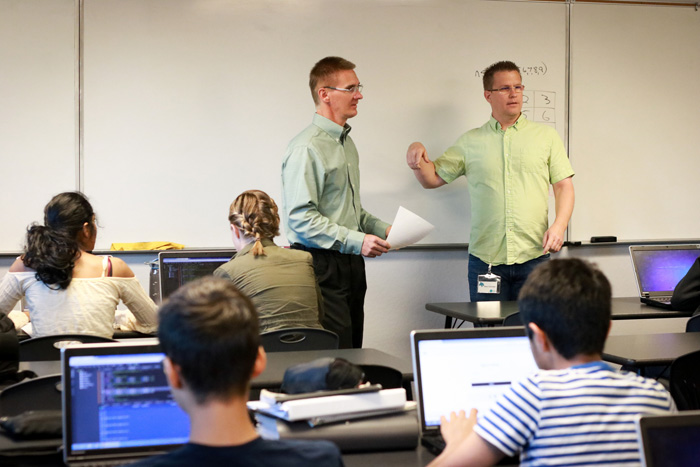
This screenshot has width=700, height=467. I want to click on laptop computers, so click(120, 382), click(169, 276), click(421, 351), click(658, 274).